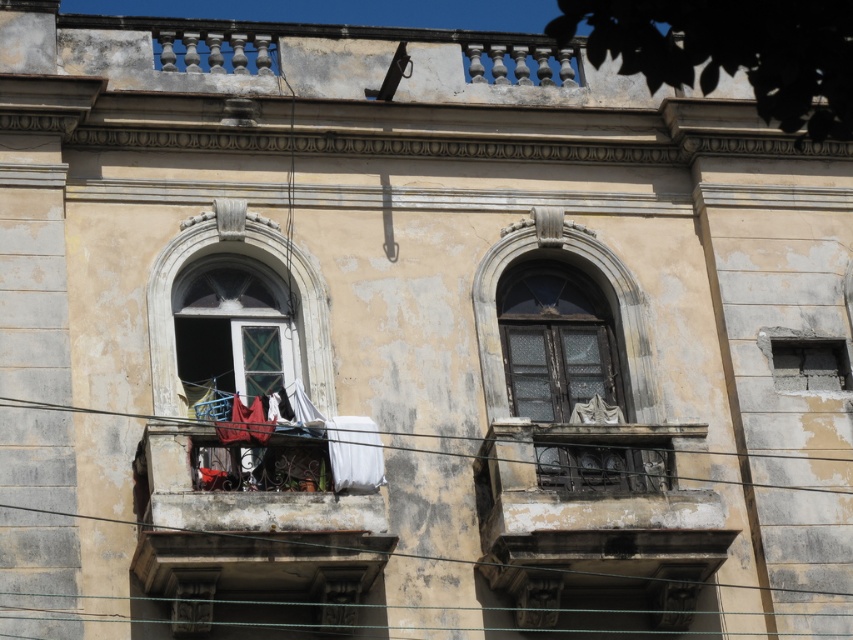
Question: Is matte glass window at center closer to camera compared to concrete/rough wall at right?

Choices:
 (A) yes
 (B) no

Answer: (A)

Question: Observing the image, what is the correct spatial positioning of dark glass window at center in reference to matte glass window at center?

Choices:
 (A) left
 (B) right

Answer: (B)

Question: Can you confirm if matte glass window at center is thinner than concrete/rough wall at right?

Choices:
 (A) yes
 (B) no

Answer: (B)

Question: Among these points, which one is nearest to the camera?

Choices:
 (A) (572, 371)
 (B) (822, 458)

Answer: (B)

Question: Based on their relative distances, which object is farther from the concrete/rough wall at right?

Choices:
 (A) metallic wire at lower center
 (B) dark glass window at center

Answer: (B)

Question: Considering the real-world distances, which object is closest to the metallic wire at lower center?

Choices:
 (A) dark glass window at center
 (B) concrete/rough wall at right

Answer: (A)